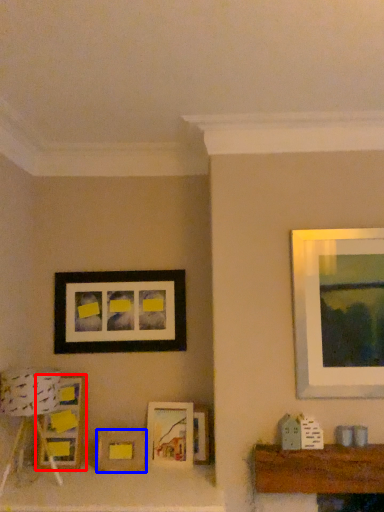
Question: Which object is further to the camera taking this photo, picture frame (highlighted by a red box) or picture frame (highlighted by a blue box)?

Choices:
 (A) picture frame
 (B) picture frame

Answer: (A)